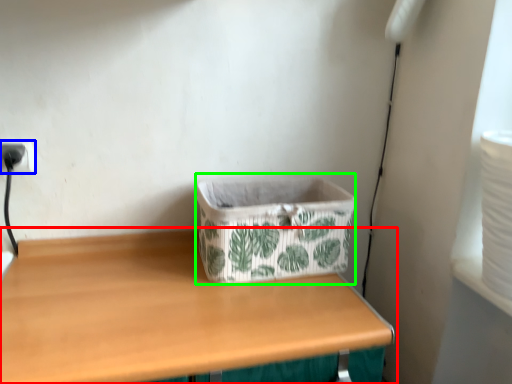
Question: Based on their relative distances, which object is farther from table (highlighted by a red box)? Choose from electric outlet (highlighted by a blue box) and storage box (highlighted by a green box).

Choices:
 (A) electric outlet
 (B) storage box

Answer: (A)